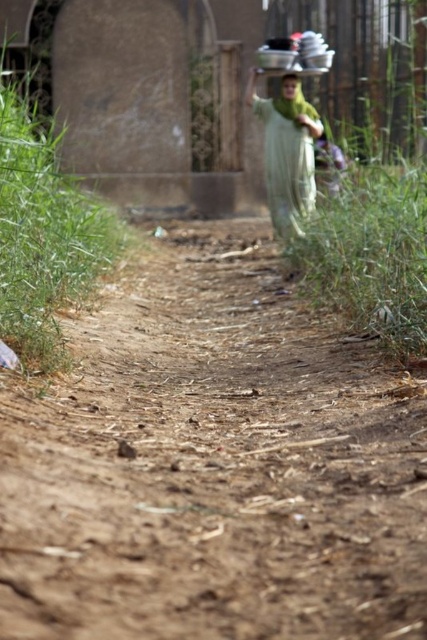
Is brown dirt track at center bigger than green fabric at center?

Actually, brown dirt track at center might be smaller than green fabric at center.

Is point (248, 470) less distant than point (292, 122)?

Yes, point (248, 470) is closer to viewer.

At what (x,y) coordinates should I click in order to perform the action: click on brown dirt track at center. Please return your answer as a coordinate pair (x, y). This screenshot has width=427, height=640. Looking at the image, I should click on (213, 465).

Which is below, brown dirt track at center or green fabric head at upper center?

brown dirt track at center is lower down.

Who is more distant from viewer, [198,612] or [286,93]?

Positioned behind is point [286,93].

Between point (294, 525) and point (289, 97), which one is positioned in front?

Point (294, 525) is more forward.

I want to click on brown dirt track at center, so pyautogui.click(x=213, y=465).

Describe the element at coordinates (286, 152) in the screenshot. I see `green fabric at center` at that location.

Measure the distance between green fabric at center and camera.

green fabric at center is 8.45 meters from camera.

I want to click on green fabric at center, so click(x=286, y=152).

This screenshot has height=640, width=427. Find the location of `green fabric at center`. green fabric at center is located at coordinates (286, 152).